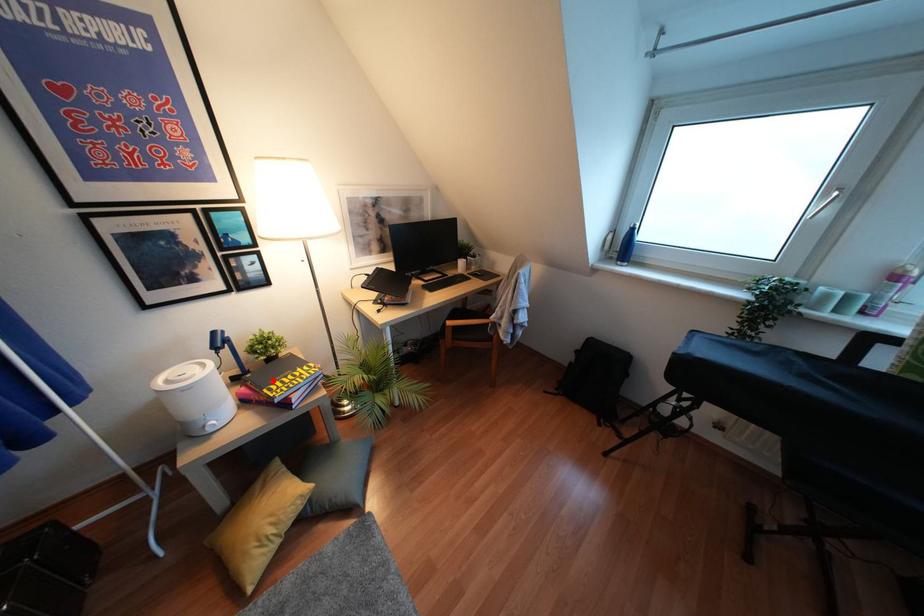
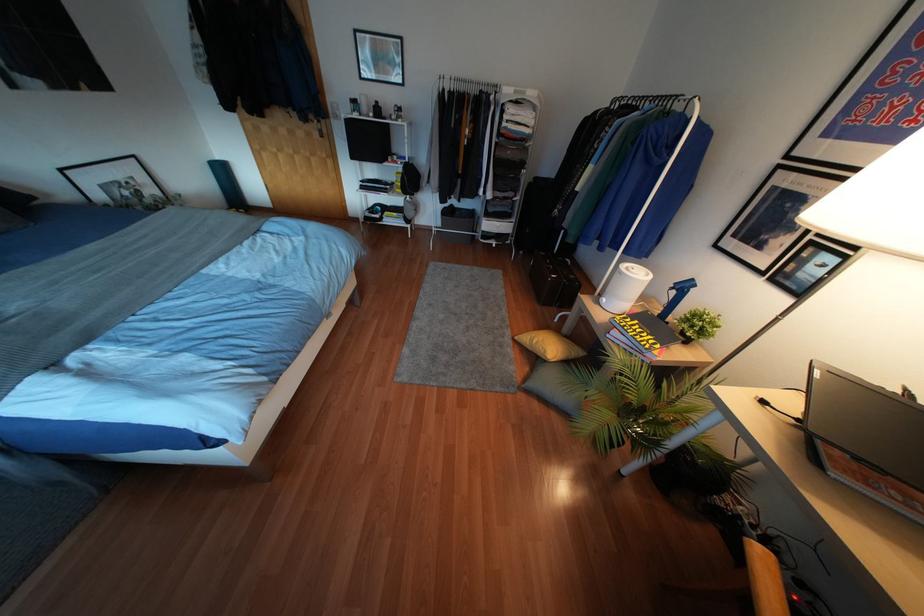
Where in the second image is the point corresponding to the highlighted location from the first image?

(637, 321)